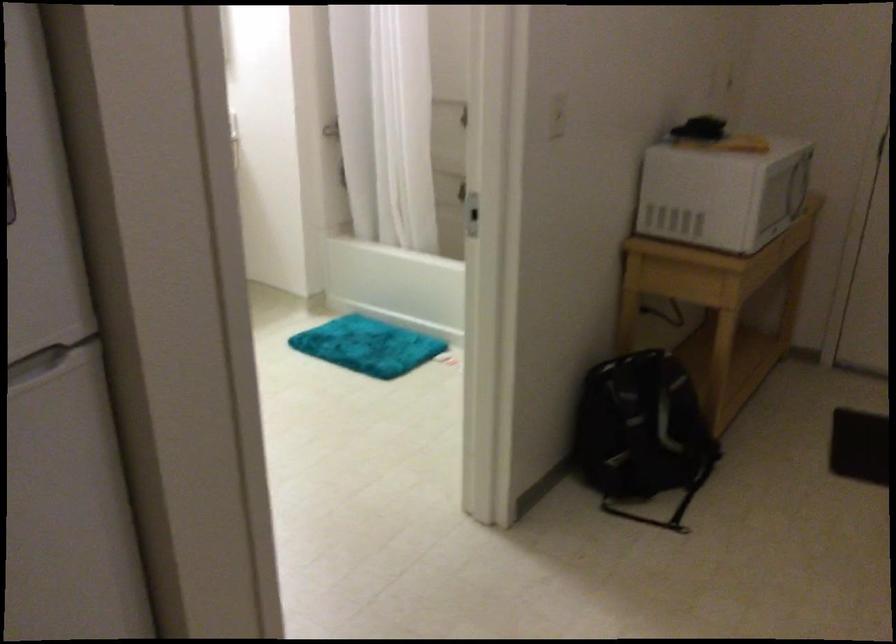
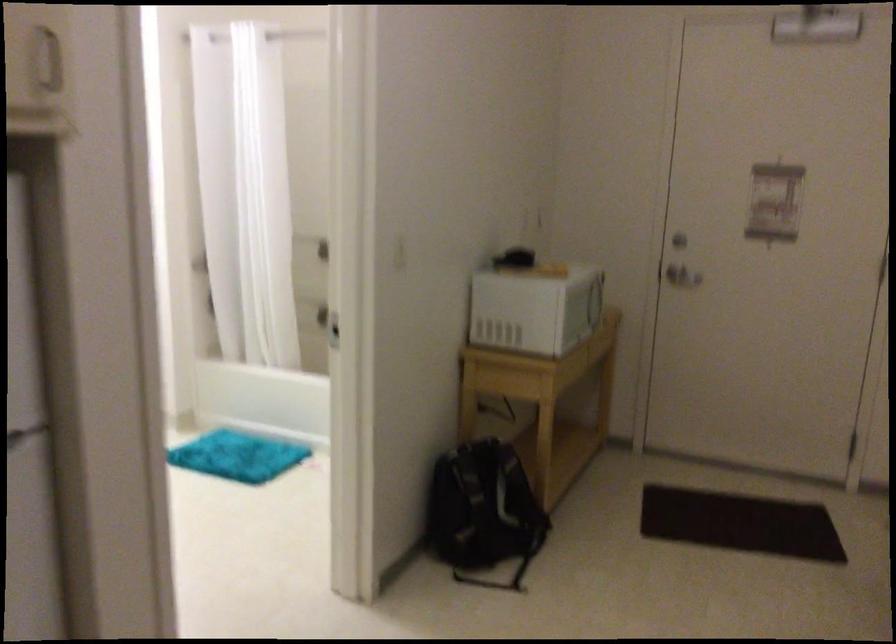
Question: The images are taken continuously from a first-person perspective. In which direction are you moving?

Choices:
 (A) Left
 (B) Right
 (C) Forward
 (D) Backward

Answer: (D)